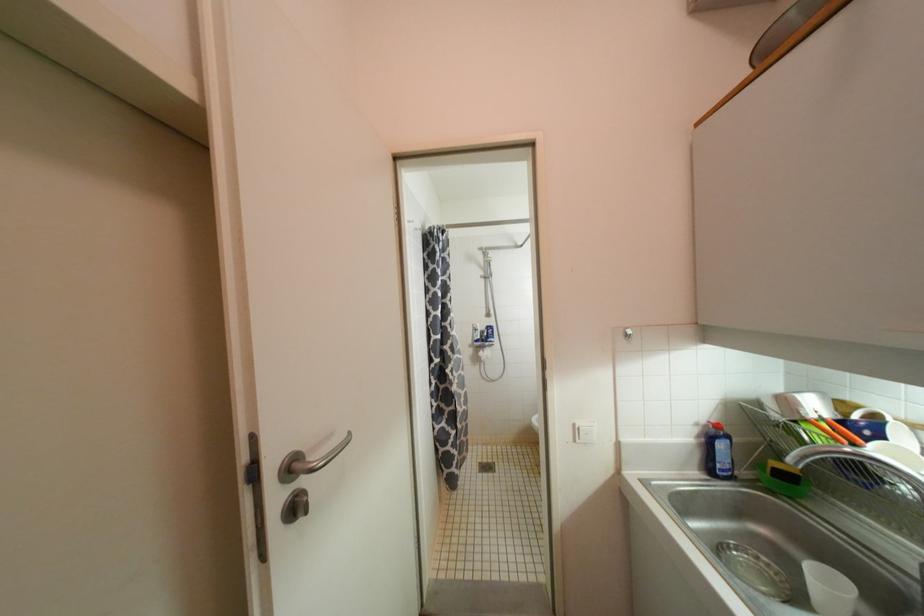
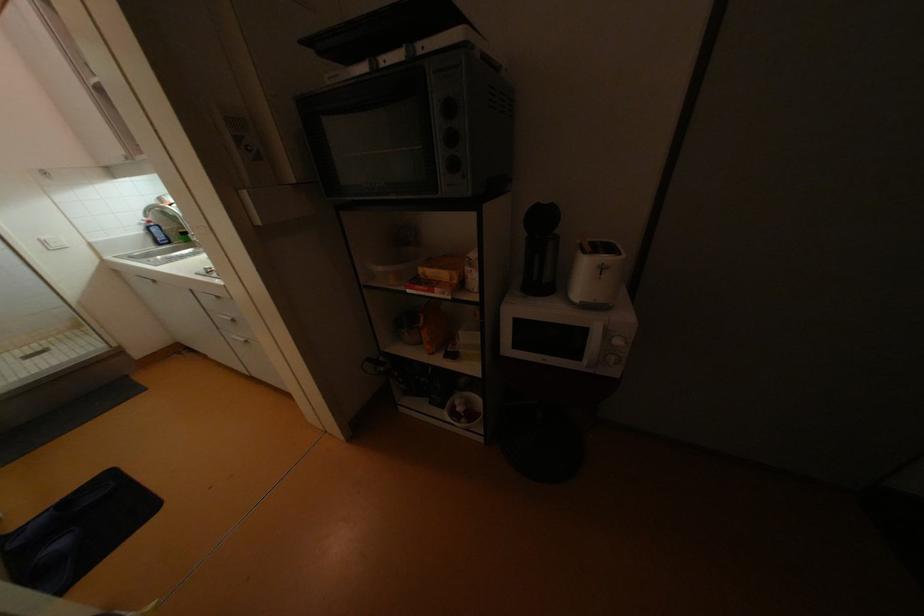
Find the pixel in the second image that matches pixel 725 447 in the first image.

(160, 231)